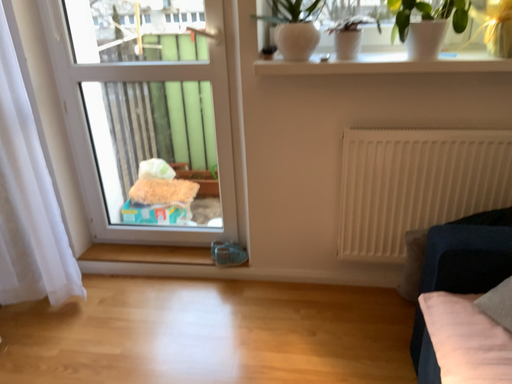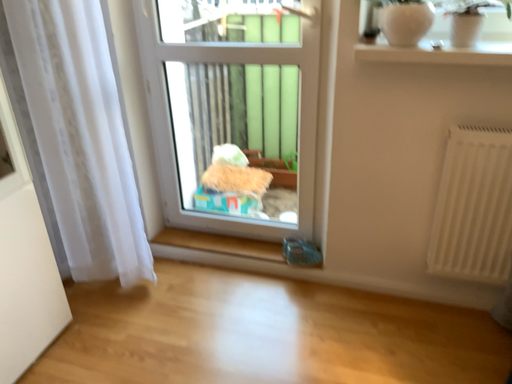
Question: How did the camera likely rotate when shooting the video?

Choices:
 (A) rotated left
 (B) rotated right

Answer: (A)